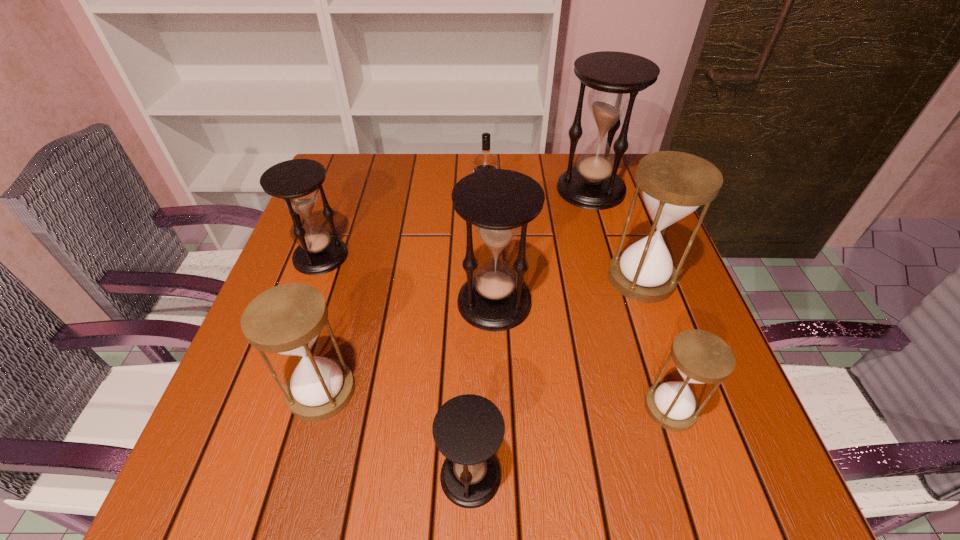
Where is `the rightmost black hourglass`? This screenshot has height=540, width=960. the rightmost black hourglass is located at coordinates (616, 78).

The height and width of the screenshot is (540, 960). Find the location of `the tallest object`. the tallest object is located at coordinates (616, 78).

You are a GUI agent. You are given a task and a screenshot of the screen. Output one action in this format:
    pyautogui.click(x=<x>, y=<y>)
    Task: Click on the second biggest black hourglass
    
    Given the screenshot: What is the action you would take?
    pyautogui.click(x=498, y=202)

Where is `the farthest white hourglass`? The image size is (960, 540). the farthest white hourglass is located at coordinates (674, 184).

Identify the location of vodka. (483, 161).

The height and width of the screenshot is (540, 960). I want to click on the second smallest black hourglass, so (x=295, y=181).

You are a GUI agent. You are given a task and a screenshot of the screen. Output one action in this format:
    pyautogui.click(x=<x>, y=<y>)
    Task: Click on the second smallest white hourglass
    The width and height of the screenshot is (960, 540).
    Given the screenshot: What is the action you would take?
    pyautogui.click(x=286, y=319)

At what (x,y) coordinates should I click in order to perform the action: click on the smallest white hourglass. Please return your answer as a coordinate pair (x, y). Image resolution: width=960 pixels, height=540 pixels. Looking at the image, I should click on (701, 357).

You are a GUI agent. You are given a task and a screenshot of the screen. Output one action in this format:
    pyautogui.click(x=<x>, y=<y>)
    Task: Click on the nearest object
    
    Given the screenshot: What is the action you would take?
    pyautogui.click(x=468, y=430)

The height and width of the screenshot is (540, 960). I want to click on the nearest hourglass, so click(x=468, y=430).